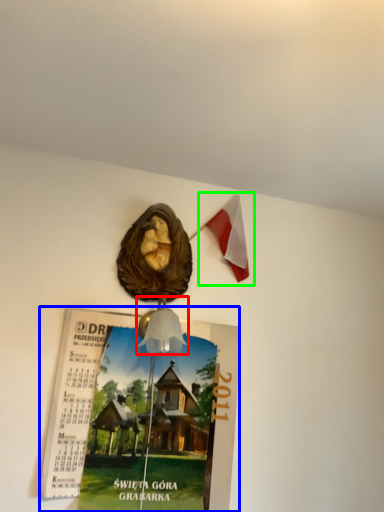
Question: Estimate the real-world distances between objects in this image. Which object is farther from lamp (highlighted by a red box), poster page (highlighted by a blue box) or flag (highlighted by a green box)?

Choices:
 (A) poster page
 (B) flag

Answer: (B)